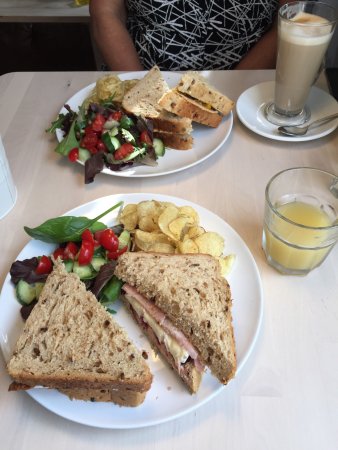
I want to click on 1 trumpet shaped glass with brown liquid, so click(x=302, y=58).